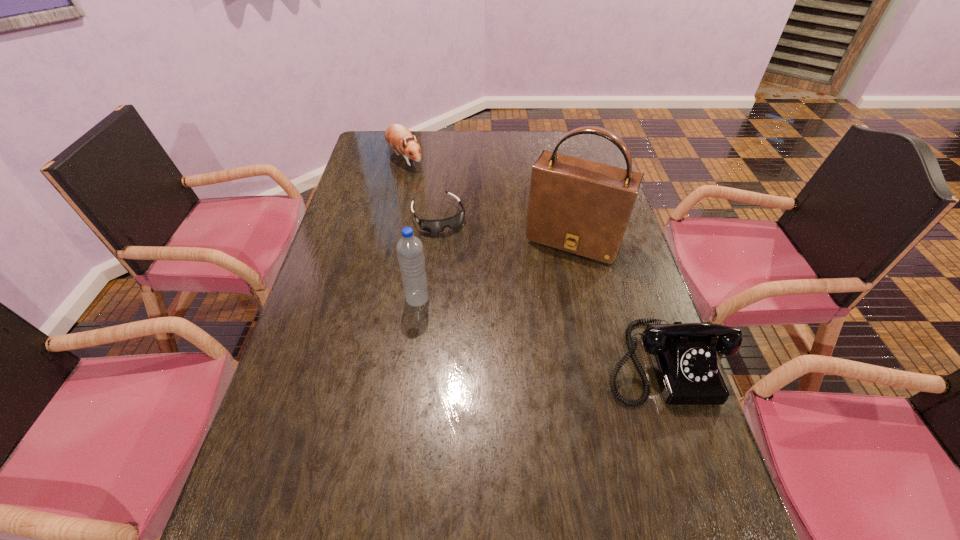
At what (x,y) coordinates should I click in order to perform the action: click on vacant spot on the desktop that is between the second tallest object and the telephone and is positioned at the face of the farthest object. Please return your answer as a coordinate pair (x, y). Looking at the image, I should click on (540, 330).

Identify the location of free space on the desktop that is between the fourth farthest object and the nearest object and is positioned on the front and sides of the goggles. (497, 319).

The height and width of the screenshot is (540, 960). I want to click on free space on the desktop that is between the second nearest object and the nearest object and is positioned on the front flap of the shoulder bag, so click(532, 328).